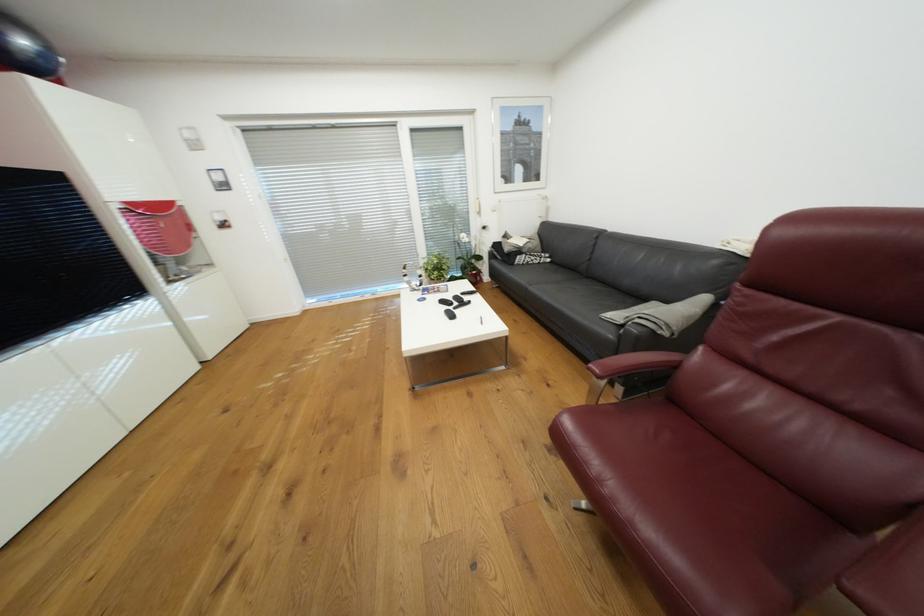
You are a GUI agent. You are given a task and a screenshot of the screen. Output one action in this format:
    pyautogui.click(x=<x>, y=<y>)
    Task: Click on the white light switch
    
    Given the screenshot: What is the action you would take?
    pyautogui.click(x=190, y=138)